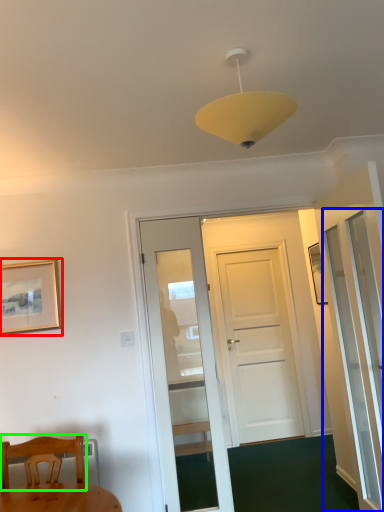
Question: Based on their relative distances, which object is nearer to picture frame (highlighted by a red box)? Choose from screen door (highlighted by a blue box) and chair (highlighted by a green box).

Choices:
 (A) screen door
 (B) chair

Answer: (B)